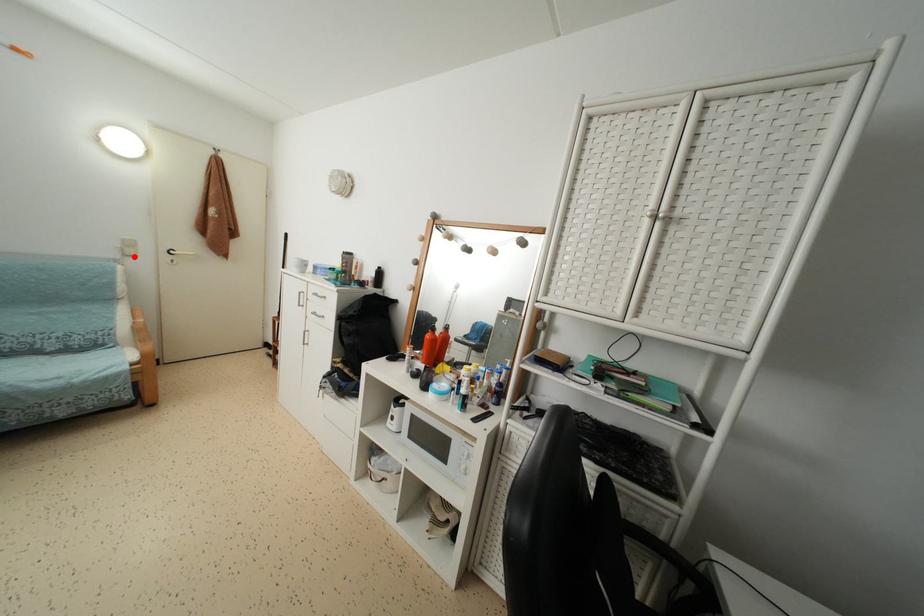
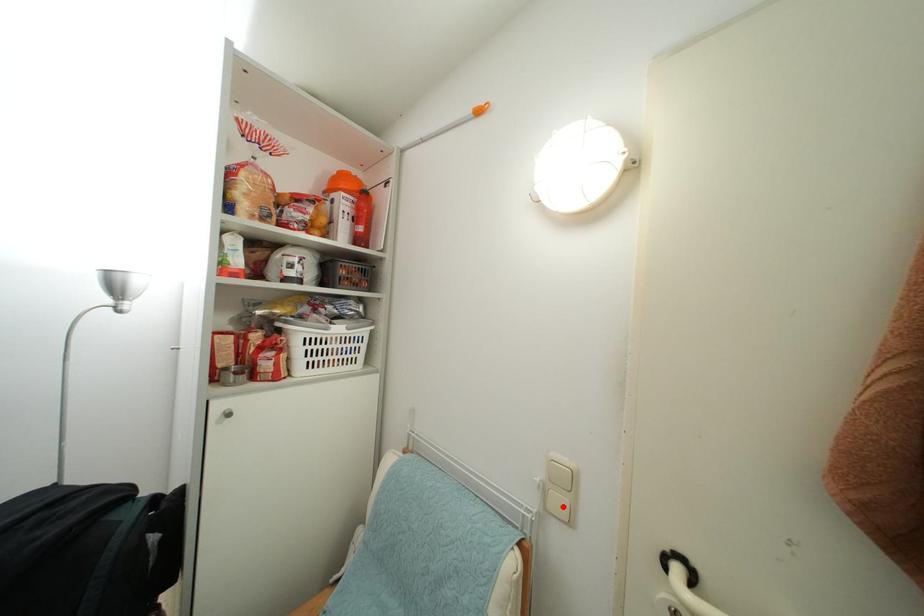
I am providing you with two images of the same scene from different viewpoints. A red point is marked on the first image and another point is marked on the second image. Does the point marked in image1 correspond to the same location as the one in image2?

Yes